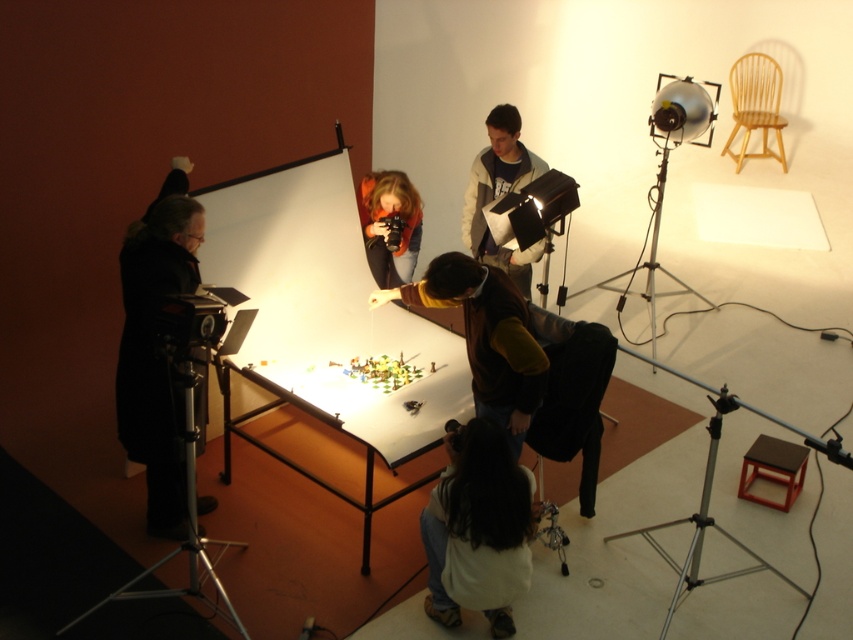
Which is below, white glossy table at center or matte orange jacket at center?

white glossy table at center is lower down.

This screenshot has width=853, height=640. Identify the location of white glossy table at center. (299, 465).

This screenshot has height=640, width=853. What do you see at coordinates (186, 518) in the screenshot? I see `silver metallic tripod at lower left` at bounding box center [186, 518].

Is silver metallic tripod at lower left to the right of silver metallic tripod at lower right from the viewer's perspective?

In fact, silver metallic tripod at lower left is to the left of silver metallic tripod at lower right.

Locate an element on the screen. This screenshot has height=640, width=853. silver metallic tripod at lower left is located at coordinates (186, 518).

Who is higher up, white glossy table at center or matte black camera at center?

Positioned higher is matte black camera at center.

Can you confirm if white glossy table at center is taller than matte black camera at center?

Yes.

Between point (433, 477) and point (386, 244), which one is positioned in front?

Point (433, 477) is more forward.

The width and height of the screenshot is (853, 640). I want to click on white glossy table at center, so click(299, 465).